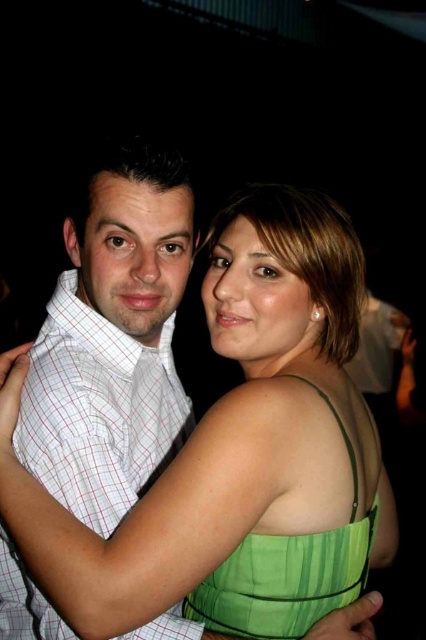
Question: Is green satin dress at center thinner than white checkered shirt at center?

Choices:
 (A) no
 (B) yes

Answer: (A)

Question: Which point is closer to the camera taking this photo?

Choices:
 (A) (353, 461)
 (B) (242, 252)
 (C) (104, 532)

Answer: (C)

Question: Which of these objects is positioned closest to the white checkered shirt at center?

Choices:
 (A) green satin dress at center
 (B) green satin dress at upper right

Answer: (A)

Question: Observing the image, what is the correct spatial positioning of green satin dress at center in reference to white checkered shirt at center?

Choices:
 (A) right
 (B) left

Answer: (A)

Question: Which object is positioned closest to the white checkered shirt at center?

Choices:
 (A) green satin dress at upper right
 (B) green satin dress at center

Answer: (B)

Question: Does green satin dress at center have a smaller size compared to white checkered shirt at center?

Choices:
 (A) yes
 (B) no

Answer: (B)